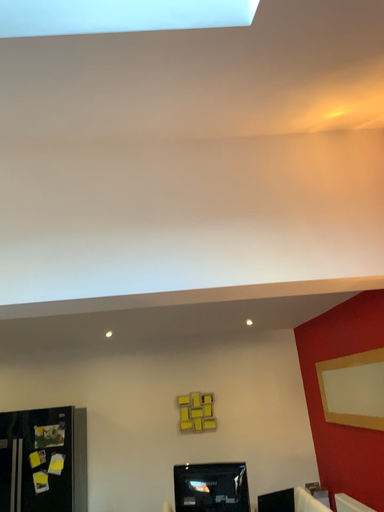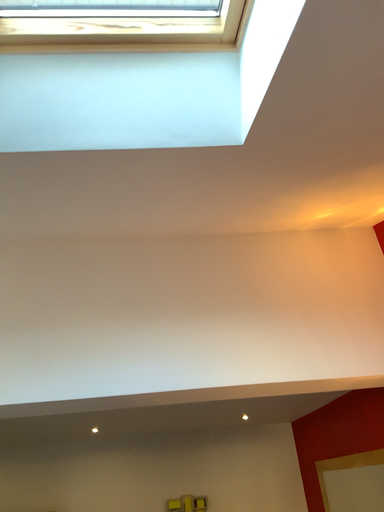
Question: Which way did the camera rotate in the video?

Choices:
 (A) rotated downward
 (B) rotated upward

Answer: (B)